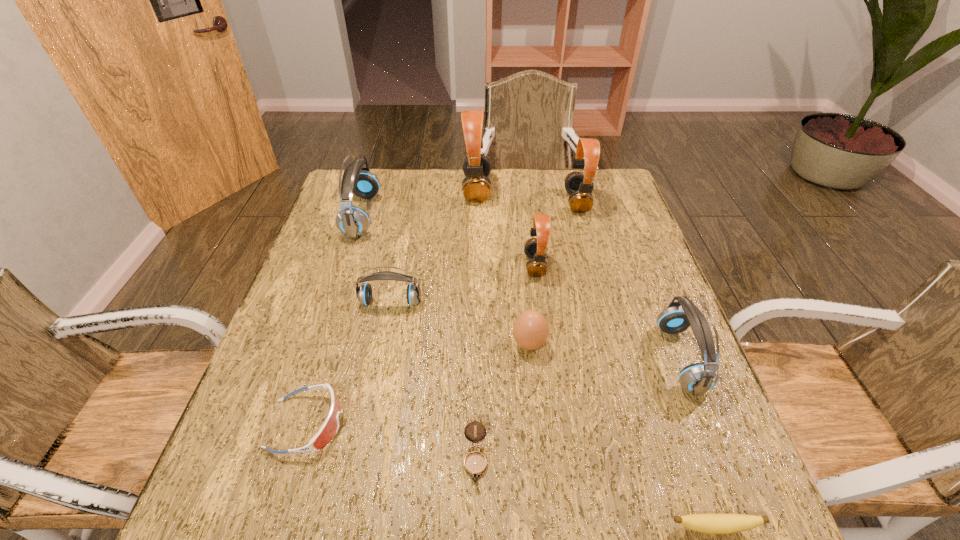
Image resolution: width=960 pixels, height=540 pixels. Find the location of `free point between the third headset from left to right and the rightmost brown headset`. free point between the third headset from left to right and the rightmost brown headset is located at coordinates (527, 195).

Where is `empty space between the brown boiled egg and the goggles`? The height and width of the screenshot is (540, 960). empty space between the brown boiled egg and the goggles is located at coordinates (418, 384).

At what (x,y) coordinates should I click in order to perform the action: click on free spot between the leftmost headset and the shortest object. Please return your answer as a coordinate pair (x, y). Looking at the image, I should click on (538, 372).

You are a GUI agent. You are given a task and a screenshot of the screen. Output one action in this format:
    pyautogui.click(x=<x>, y=<y>)
    Task: Click on the vacant area that lies between the compass and the farthest blue headset
    
    Given the screenshot: What is the action you would take?
    pyautogui.click(x=419, y=338)

The width and height of the screenshot is (960, 540). Find the location of `vacant space in between the brown boiled egg and the rightmost brown headset`. vacant space in between the brown boiled egg and the rightmost brown headset is located at coordinates (553, 273).

Identify the location of free space between the leftmost headset and the rightmost blue headset. This screenshot has width=960, height=540. (521, 287).

This screenshot has height=540, width=960. I want to click on the second closest object to the brown boiled egg, so click(475, 463).

Image resolution: width=960 pixels, height=540 pixels. In order to click on object that is the second closest one to the boiled egg in this screenshot , I will do `click(475, 463)`.

Choose which headset is the second nearest neighbor to the goggles. Please provide its 2D coordinates. Your answer should be formatted as a tuple, i.e. [(x, y)], where the tuple contains the x and y coordinates of a point satisfying the conditions above.

[(352, 221)]

This screenshot has height=540, width=960. Find the location of `headset that stands as the second closest to the goggles`. headset that stands as the second closest to the goggles is located at coordinates (352, 221).